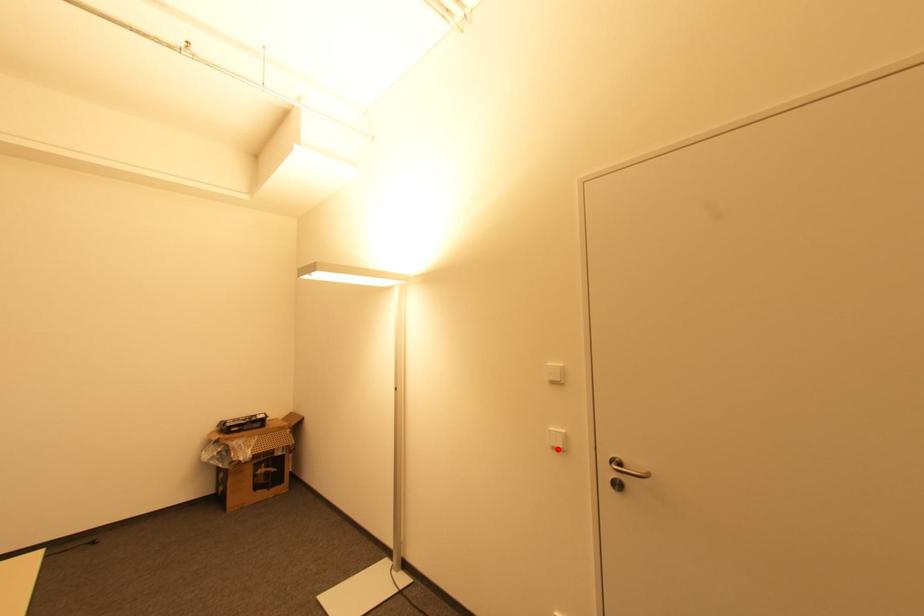
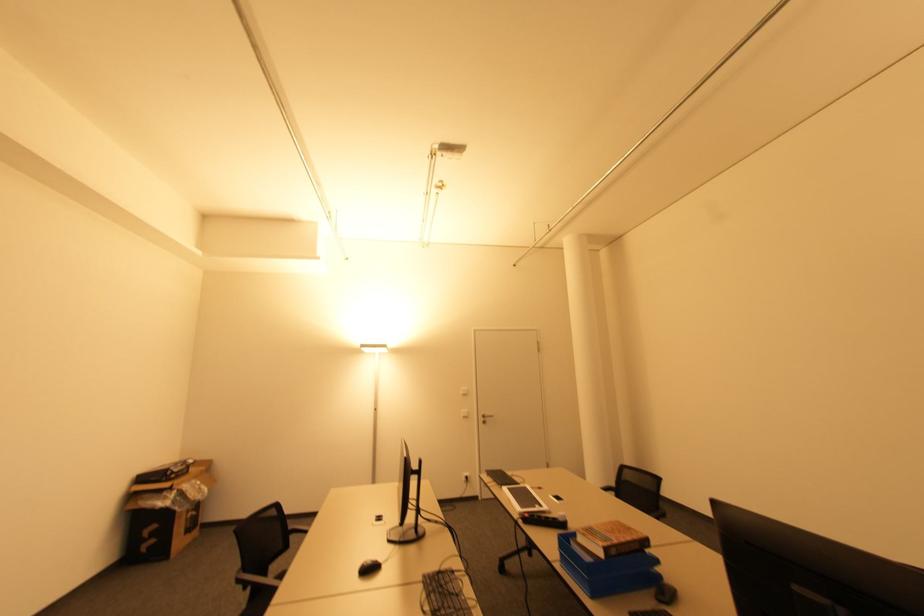
Question: I am providing you with two images of the same scene from different viewpoints. A red point is marked on the first image. Can you still see the location of the red point in image 2?

Choices:
 (A) Yes
 (B) No

Answer: (A)